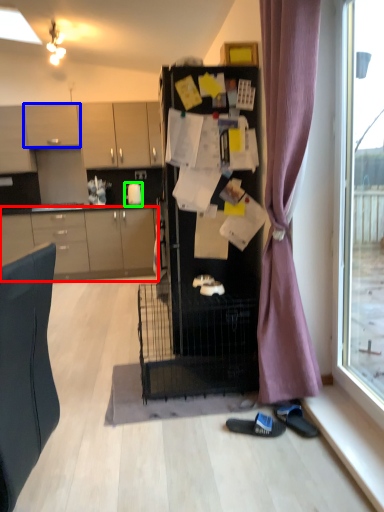
Question: Which object is the farthest from cabinetry (highlighted by a red box)? Choose among these: cabinetry (highlighted by a blue box) or teapot (highlighted by a green box).

Choices:
 (A) cabinetry
 (B) teapot

Answer: (A)